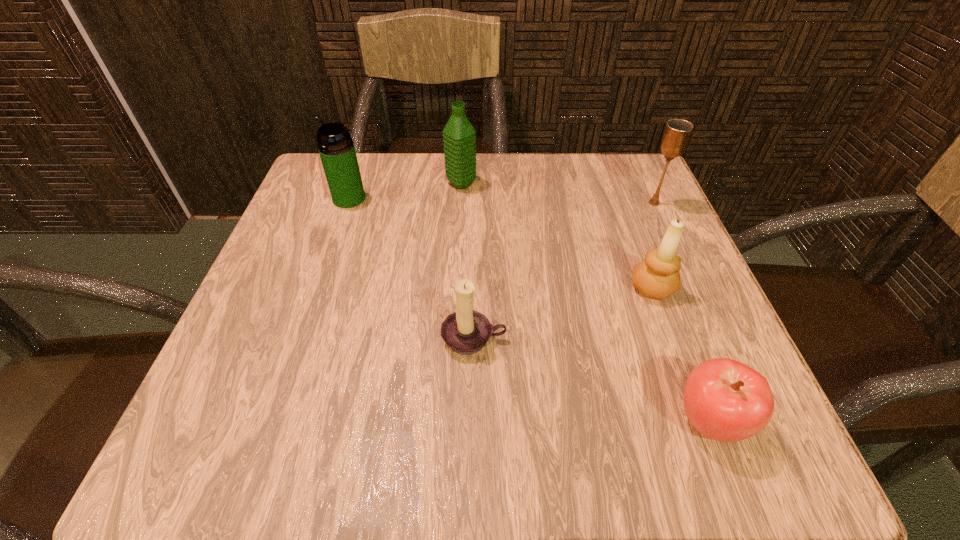
Identify the location of free location located on the front of the fourth farthest object. The image size is (960, 540). (716, 461).

Where is `free location located on the wick of the shorter candle holder`? This screenshot has width=960, height=540. free location located on the wick of the shorter candle holder is located at coordinates pyautogui.click(x=473, y=410).

Locate an element on the screen. free space located 0.200m on the back of the nearest object is located at coordinates (657, 284).

Find the location of `thermos bottle that is at the far edge`. thermos bottle that is at the far edge is located at coordinates (336, 148).

Where is `water bottle that is at the far edge`? water bottle that is at the far edge is located at coordinates (459, 135).

At what (x,y) coordinates should I click in order to perform the action: click on chalice at the far edge. Please return your answer as a coordinate pair (x, y). This screenshot has width=960, height=540. Looking at the image, I should click on (677, 133).

This screenshot has width=960, height=540. In order to click on object present at the near edge in this screenshot , I will do `click(725, 400)`.

Where is `object situated at the left edge`? object situated at the left edge is located at coordinates (336, 148).

Where is `chalice that is at the right edge`? The image size is (960, 540). chalice that is at the right edge is located at coordinates (677, 133).

This screenshot has height=540, width=960. What are the coordinates of `candle_holder present at the right edge` in the screenshot? It's located at (658, 277).